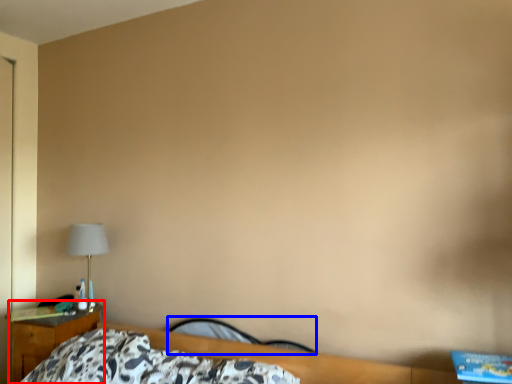
Question: Which point is further to the camera, nightstand (highlighted by a red box) or chair (highlighted by a blue box)?

Choices:
 (A) nightstand
 (B) chair

Answer: (A)